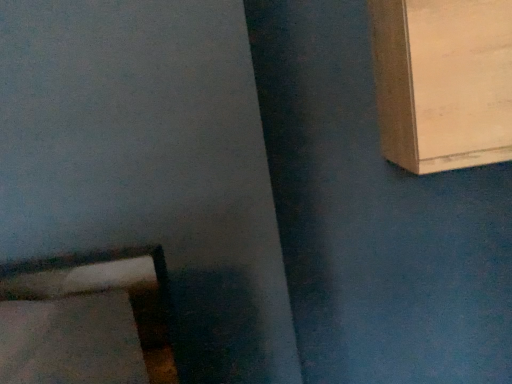
Locate an element on the screen. This screenshot has height=384, width=512. light brown wood at upper right is located at coordinates (443, 82).

The image size is (512, 384). What do you see at coordinates (443, 82) in the screenshot?
I see `light brown wood at upper right` at bounding box center [443, 82].

Locate an element on the screen. This screenshot has height=384, width=512. light brown wood at upper right is located at coordinates [x=443, y=82].